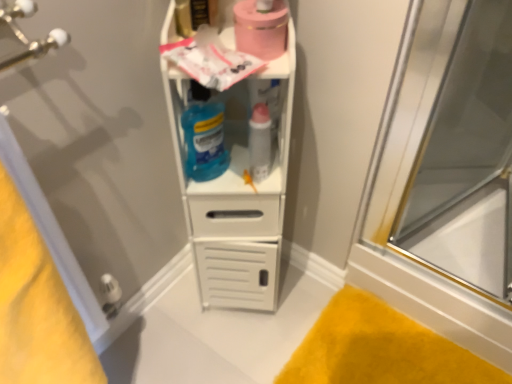
Question: From the image's perspective, is transparent glass door at right on translucent blue liquid at center?

Choices:
 (A) no
 (B) yes

Answer: (B)

Question: From the image's perspective, is transparent glass door at right located beneath translucent blue liquid at center?

Choices:
 (A) no
 (B) yes

Answer: (A)

Question: Would you say transparent glass door at right contains translucent blue liquid at center?

Choices:
 (A) no
 (B) yes

Answer: (A)

Question: Is transparent glass door at right not near translucent blue liquid at center?

Choices:
 (A) yes
 (B) no

Answer: (B)

Question: Is transparent glass door at right taller than translucent blue liquid at center?

Choices:
 (A) yes
 (B) no

Answer: (A)

Question: Is matte plastic lipstick at center situated inside white plastic shelf at center or outside?

Choices:
 (A) outside
 (B) inside

Answer: (B)

Question: Based on their positions, is matte plastic lipstick at center located to the left or right of white plastic shelf at center?

Choices:
 (A) left
 (B) right

Answer: (B)

Question: From the image's perspective, is matte plastic lipstick at center above or below white plastic shelf at center?

Choices:
 (A) below
 (B) above

Answer: (B)

Question: In terms of width, does matte plastic lipstick at center look wider or thinner when compared to white plastic shelf at center?

Choices:
 (A) thin
 (B) wide

Answer: (A)

Question: Would you say white plastic shelf at center is to the left or to the right of yellow plush bath mat at lower right in the picture?

Choices:
 (A) left
 (B) right

Answer: (A)

Question: Is white plastic shelf at center wider or thinner than yellow plush bath mat at lower right?

Choices:
 (A) wide
 (B) thin

Answer: (B)

Question: In the image, is white plastic shelf at center positioned in front of or behind yellow plush bath mat at lower right?

Choices:
 (A) behind
 (B) front

Answer: (B)

Question: In terms of height, does white plastic shelf at center look taller or shorter compared to yellow plush bath mat at lower right?

Choices:
 (A) short
 (B) tall

Answer: (B)

Question: In terms of size, does white plastic shelf at center appear bigger or smaller than pink matte toilet paper at upper center?

Choices:
 (A) big
 (B) small

Answer: (A)

Question: From the image's perspective, is white plastic shelf at center positioned above or below pink matte toilet paper at upper center?

Choices:
 (A) below
 (B) above

Answer: (A)